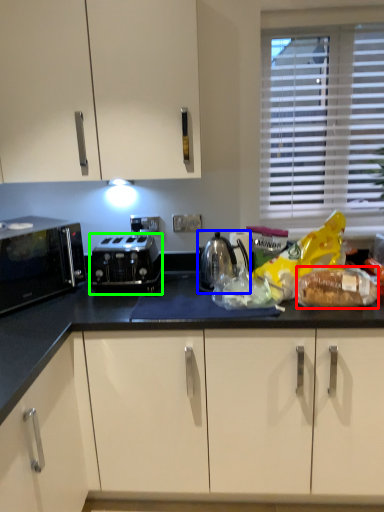
Question: Based on their relative distances, which object is farther from stuff (highlighted by a red box)? Choose from kitchen appliance (highlighted by a blue box) and toaster (highlighted by a green box).

Choices:
 (A) kitchen appliance
 (B) toaster

Answer: (B)